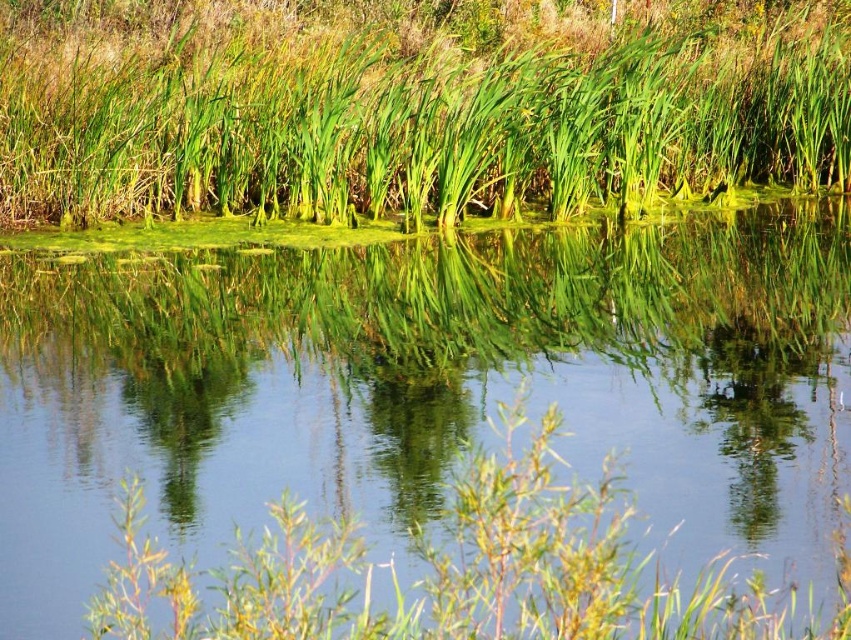
Question: Can you confirm if green grassy lake at upper center is positioned to the left of green grass at center?

Choices:
 (A) no
 (B) yes

Answer: (B)

Question: Among these points, which one is nearest to the camera?

Choices:
 (A) click(x=678, y=99)
 (B) click(x=524, y=269)
 (C) click(x=175, y=460)

Answer: (C)

Question: Which point is farther to the camera?

Choices:
 (A) green grass at center
 (B) green grassy lake at upper center
 (C) green glossy reeds at center

Answer: (C)

Question: Where is green grassy lake at upper center located in relation to green grass at center in the image?

Choices:
 (A) above
 (B) below

Answer: (A)

Question: Does green grassy lake at upper center have a smaller size compared to green grass at upper center?

Choices:
 (A) no
 (B) yes

Answer: (B)

Question: Which object is positioned farthest from the green glossy reeds at center?

Choices:
 (A) green grass at center
 (B) green grass at upper center

Answer: (B)